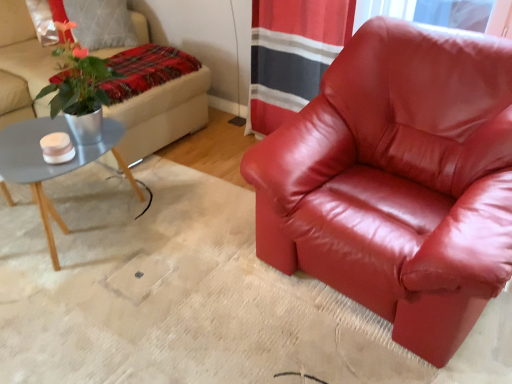
Question: Considering the relative sizes of matte gray coffee table at left and satin red armchair at center in the image provided, is matte gray coffee table at left taller than satin red armchair at center?

Choices:
 (A) no
 (B) yes

Answer: (A)

Question: From the image's perspective, does matte gray coffee table at left appear lower than satin red armchair at center?

Choices:
 (A) yes
 (B) no

Answer: (A)

Question: Is matte gray coffee table at left facing towards satin red armchair at center?

Choices:
 (A) no
 (B) yes

Answer: (B)

Question: Can you confirm if matte gray coffee table at left is smaller than satin red armchair at center?

Choices:
 (A) no
 (B) yes

Answer: (B)

Question: Can you confirm if matte gray coffee table at left is thinner than satin red armchair at center?

Choices:
 (A) yes
 (B) no

Answer: (A)

Question: From a real-world perspective, is matte gray coffee table at left located beneath satin red armchair at center?

Choices:
 (A) no
 (B) yes

Answer: (B)

Question: Is plaid fabric blanket at upper left at the right side of matte gray coffee table at left?

Choices:
 (A) no
 (B) yes

Answer: (B)

Question: Considering the relative sizes of plaid fabric blanket at upper left and matte gray coffee table at left in the image provided, is plaid fabric blanket at upper left wider than matte gray coffee table at left?

Choices:
 (A) yes
 (B) no

Answer: (B)

Question: Does plaid fabric blanket at upper left come behind matte gray coffee table at left?

Choices:
 (A) yes
 (B) no

Answer: (A)

Question: From a real-world perspective, is plaid fabric blanket at upper left physically below matte gray coffee table at left?

Choices:
 (A) yes
 (B) no

Answer: (B)

Question: Is plaid fabric blanket at upper left facing towards matte gray coffee table at left?

Choices:
 (A) no
 (B) yes

Answer: (A)

Question: Is plaid fabric blanket at upper left smaller than matte gray coffee table at left?

Choices:
 (A) no
 (B) yes

Answer: (B)

Question: Can you confirm if satin red armchair at center is smaller than plaid fabric blanket at upper left?

Choices:
 (A) no
 (B) yes

Answer: (A)